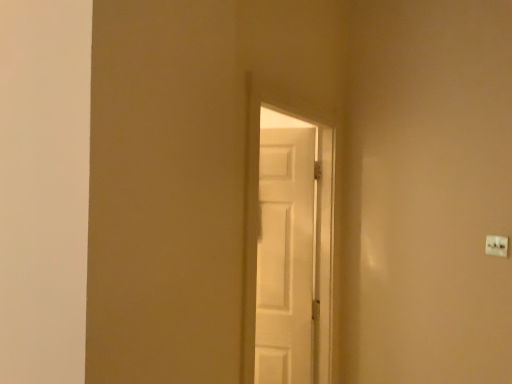
Question: Should I look upward or downward to see white matte door at center?

Choices:
 (A) up
 (B) down

Answer: (B)

Question: Is white plastic light switch at upper right at the right side of white matte door at center?

Choices:
 (A) yes
 (B) no

Answer: (A)

Question: Does white plastic light switch at upper right have a lesser height compared to white matte door at center?

Choices:
 (A) yes
 (B) no

Answer: (A)

Question: Is white plastic light switch at upper right looking in the opposite direction of white matte door at center?

Choices:
 (A) yes
 (B) no

Answer: (B)

Question: Is white matte door at center inside white plastic light switch at upper right?

Choices:
 (A) yes
 (B) no

Answer: (B)

Question: Is white plastic light switch at upper right located outside white matte door at center?

Choices:
 (A) yes
 (B) no

Answer: (A)

Question: Considering the relative sizes of white plastic light switch at upper right and white matte door at center in the image provided, is white plastic light switch at upper right smaller than white matte door at center?

Choices:
 (A) yes
 (B) no

Answer: (A)

Question: Does white matte door at center lie in front of white plastic light switch at upper right?

Choices:
 (A) yes
 (B) no

Answer: (A)

Question: Can you confirm if white matte door at center is positioned to the right of white plastic light switch at upper right?

Choices:
 (A) no
 (B) yes

Answer: (A)

Question: Is white plastic light switch at upper right completely or partially inside white matte door at center?

Choices:
 (A) no
 (B) yes

Answer: (A)

Question: Are white matte door at center and white plastic light switch at upper right far apart?

Choices:
 (A) yes
 (B) no

Answer: (A)

Question: From the image's perspective, is white matte door at center below white plastic light switch at upper right?

Choices:
 (A) yes
 (B) no

Answer: (A)

Question: Can you confirm if white matte door at center is thinner than white plastic light switch at upper right?

Choices:
 (A) yes
 (B) no

Answer: (B)

Question: Is point (243, 367) closer or farther from the camera than point (503, 244)?

Choices:
 (A) closer
 (B) farther

Answer: (A)